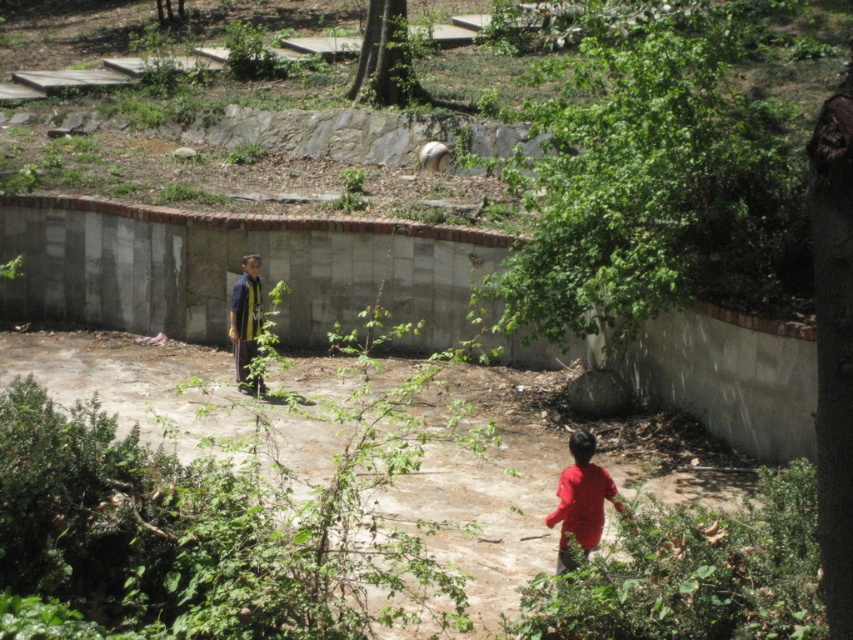
Is red matte shirt at lower right below yellow jersey at center?

Yes, red matte shirt at lower right is below yellow jersey at center.

Image resolution: width=853 pixels, height=640 pixels. Find the location of `red matte shirt at lower right`. red matte shirt at lower right is located at coordinates (579, 500).

This screenshot has height=640, width=853. Find the location of `red matte shirt at lower right`. red matte shirt at lower right is located at coordinates (579, 500).

At what (x,y) coordinates should I click in order to perform the action: click on red matte shirt at lower right. Please return your answer as a coordinate pair (x, y). Looking at the image, I should click on (579, 500).